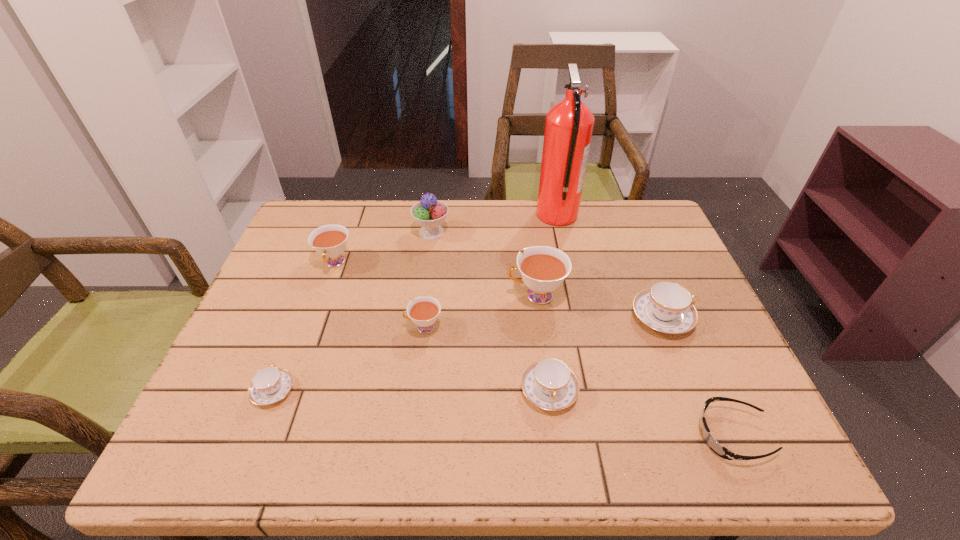
Locate which blue teacup is the closest to the rightmost blue teacup. Please provide its 2D coordinates. Your answer should be formatted as a tuple, i.e. [(x, y)], where the tuple contains the x and y coordinates of a point satisfying the conditions above.

[(549, 384)]

What are the coordinates of `blue teacup that stands as the closest to the second smallest blue teacup` in the screenshot? It's located at (666, 307).

Locate an element on the screen. Image resolution: width=960 pixels, height=540 pixels. vacant space that satisfies the following two spatial constraints: 1. at the nozzle of the tallest object; 2. on the side of the farthest teacup with the handle is located at coordinates (567, 263).

You are a GUI agent. You are given a task and a screenshot of the screen. Output one action in this format:
    pyautogui.click(x=<x>, y=<y>)
    Task: Click on the vacant area that satisfies the following two spatial constraints: 1. on the side with the handle of the shortest teacup; 2. on the right side of the icecream
    
    Given the screenshot: What is the action you would take?
    pyautogui.click(x=335, y=232)

Find the location of a particular element. Image resolution: width=960 pixels, height=540 pixels. free spot that satisfies the following two spatial constraints: 1. on the side with the handle of the icecream; 2. on the left side of the smallest blue teacup is located at coordinates (335, 232).